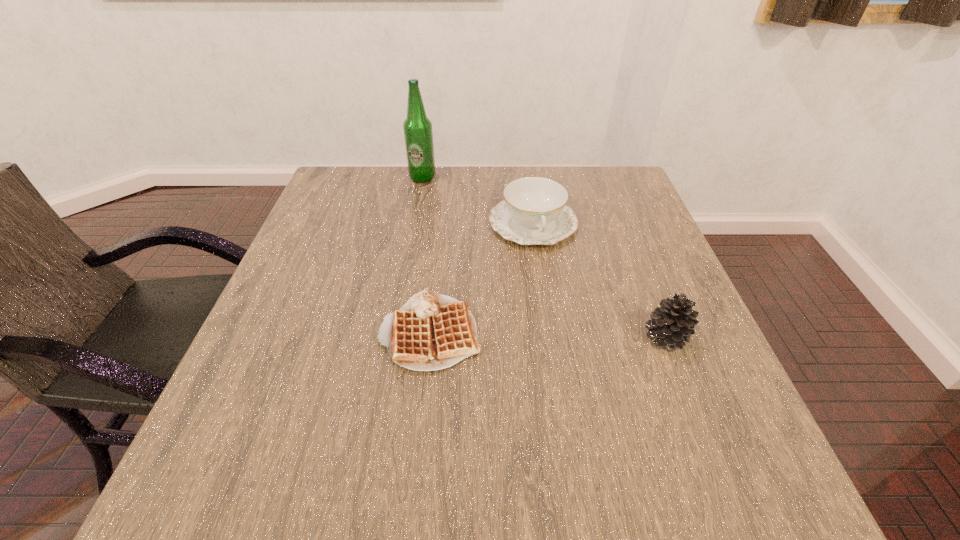
In order to click on blank space at the left edge in this screenshot , I will do `click(306, 230)`.

This screenshot has width=960, height=540. I want to click on free region at the far left corner of the desktop, so click(359, 170).

This screenshot has height=540, width=960. In the image, there is a desktop. What are the coordinates of `vacant space at the far right corner` in the screenshot? It's located at (602, 166).

Locate an element on the screen. Image resolution: width=960 pixels, height=540 pixels. vacant space at the near right corner of the desktop is located at coordinates (644, 394).

What are the coordinates of `empty space between the second object from right to left and the tallest object` in the screenshot? It's located at (477, 200).

What are the coordinates of `vacant space that is in between the farthest object and the rightmost object` in the screenshot? It's located at (544, 258).

This screenshot has height=540, width=960. I want to click on free space between the rightmost object and the chinaware, so click(x=599, y=281).

Where is `empty space that is in between the third object from left to right and the rightmost object`? This screenshot has height=540, width=960. empty space that is in between the third object from left to right and the rightmost object is located at coordinates (599, 281).

Locate an element on the screen. This screenshot has height=540, width=960. free space between the third shortest object and the second shortest object is located at coordinates (599, 281).

This screenshot has width=960, height=540. What are the coordinates of `vacant space that is in between the rightmost object and the third object from left to right` in the screenshot? It's located at (599, 281).